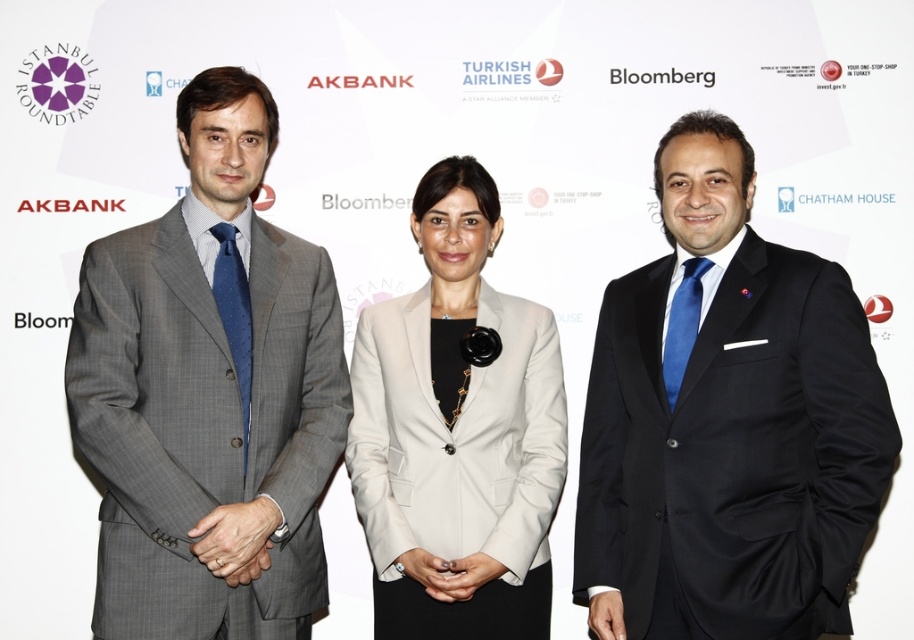
You are attending a professional conference and see two people in the image. One is wearing a gray textured suit at left, and the other is wearing a light beige fabric blazer at center. Which person is standing to the right of the other?

The light beige fabric blazer at center is positioned to the right of the gray textured suit at left.

You are a photographer setting up for a group photo. You notice two people in the scene wearing the black satin suit at right and the gray textured suit at left. Which suit is positioned closer to the camera?

The black satin suit at right is closer to the viewer than the gray textured suit at left, so the black satin suit at right is positioned closer to the camera.